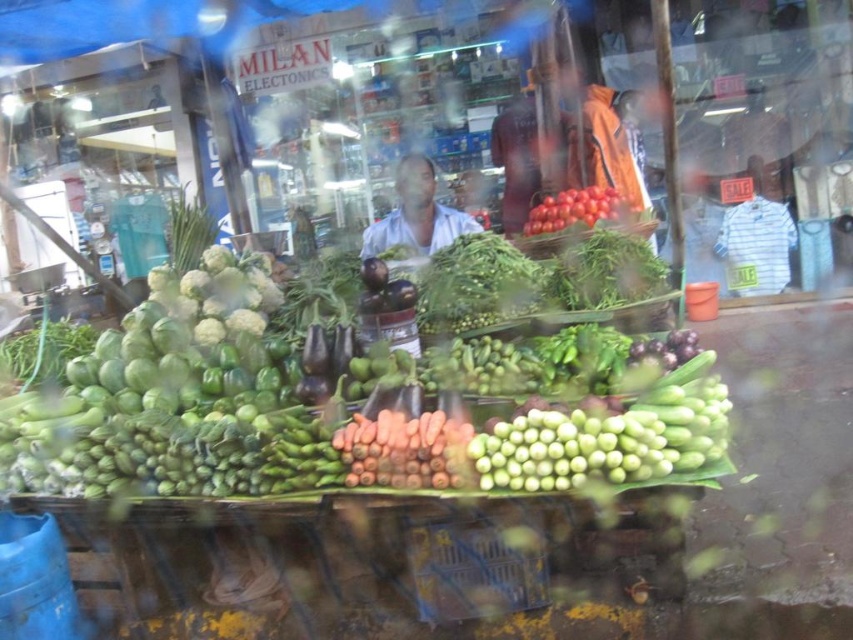
Can you confirm if matte orange shirt at center is thinner than white fabric shirt at center?

Yes.

The width and height of the screenshot is (853, 640). Describe the element at coordinates (529, 152) in the screenshot. I see `matte orange shirt at center` at that location.

The image size is (853, 640). I want to click on matte orange shirt at center, so click(x=529, y=152).

Can you confirm if green matte eggplant at center is positioned below matte orange shirt at center?

Correct, green matte eggplant at center is located below matte orange shirt at center.

Is green matte eggplant at center behind matte orange shirt at center?

No, green matte eggplant at center is in front of matte orange shirt at center.

Is point (42, 493) closer to viewer compared to point (526, 144)?

Yes, point (42, 493) is closer to viewer.

This screenshot has width=853, height=640. I want to click on green matte eggplant at center, so click(370, 392).

Does point (639, 385) come in front of point (395, 483)?

No, (639, 385) is further to viewer.

Is green matte eggplant at center further to the viewer compared to orange matte carrots at center?

That is False.

The height and width of the screenshot is (640, 853). What do you see at coordinates (370, 392) in the screenshot?
I see `green matte eggplant at center` at bounding box center [370, 392].

Find the location of a particular element. This screenshot has width=853, height=640. green matte eggplant at center is located at coordinates (370, 392).